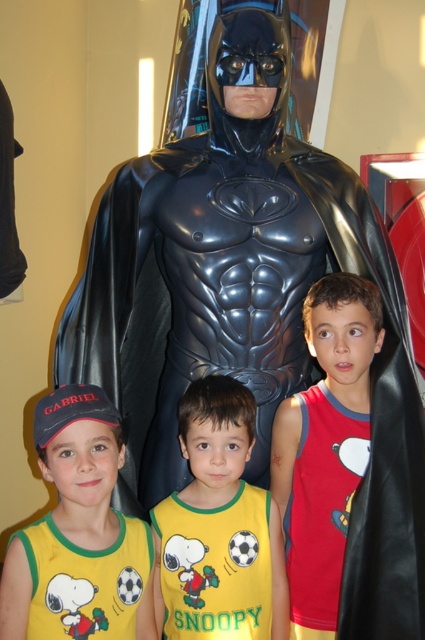
Question: Is yellow-green t-shirt at center smaller than yellow-green jersey with snoopy print at lower left?

Choices:
 (A) no
 (B) yes

Answer: (A)

Question: Does yellow jersey at center have a greater width compared to red cotton tank top at center?

Choices:
 (A) yes
 (B) no

Answer: (A)

Question: Among these objects, which one is farthest from the camera?

Choices:
 (A) yellow-green jersey with snoopy print at lower left
 (B) red cotton tank top at center
 (C) yellow jersey at center
 (D) yellow-green t-shirt at center

Answer: (B)

Question: Which of the following is the closest to the observer?

Choices:
 (A) (65, 627)
 (B) (159, 502)
 (C) (87, 611)
 (D) (323, 577)

Answer: (A)

Question: Does yellow jersey at center appear over yellow-green jersey with snoopy print at lower left?

Choices:
 (A) yes
 (B) no

Answer: (A)

Question: Which of the following is the farthest from the observer?

Choices:
 (A) (379, 320)
 (B) (252, 609)

Answer: (A)